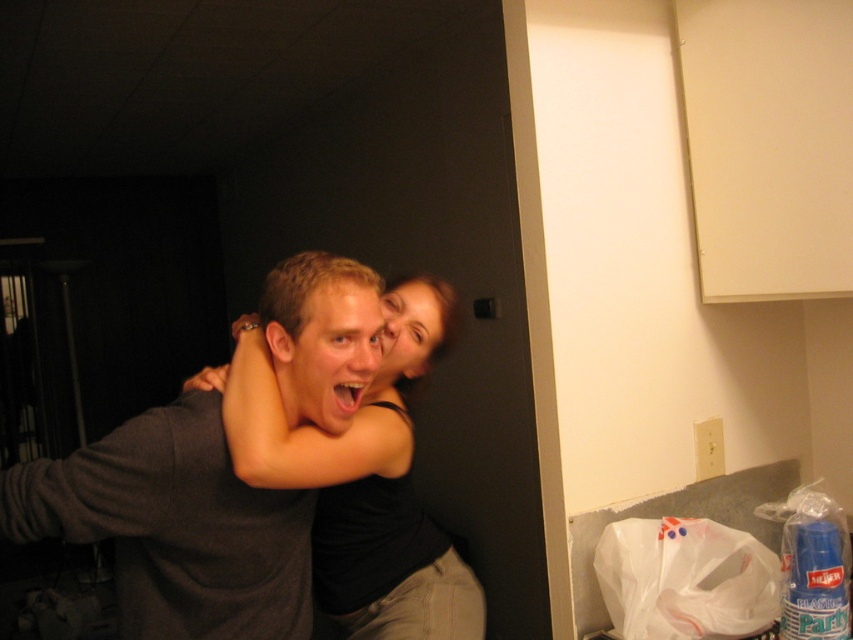
Question: Which point is farther from the camera taking this photo?

Choices:
 (A) (347, 460)
 (B) (345, 332)

Answer: (A)

Question: Which of the following is the closest to the observer?

Choices:
 (A) (264, 605)
 (B) (282, 474)

Answer: (B)

Question: Can you confirm if dark gray shirt at center is positioned to the right of black matte skin at center?

Choices:
 (A) yes
 (B) no

Answer: (B)

Question: Can you confirm if dark gray shirt at center is positioned to the right of black matte skin at center?

Choices:
 (A) no
 (B) yes

Answer: (A)

Question: Does dark gray shirt at center have a smaller size compared to black matte skin at center?

Choices:
 (A) no
 (B) yes

Answer: (B)

Question: Which object appears farthest from the camera in this image?

Choices:
 (A) black matte skin at center
 (B) dark gray shirt at center

Answer: (A)